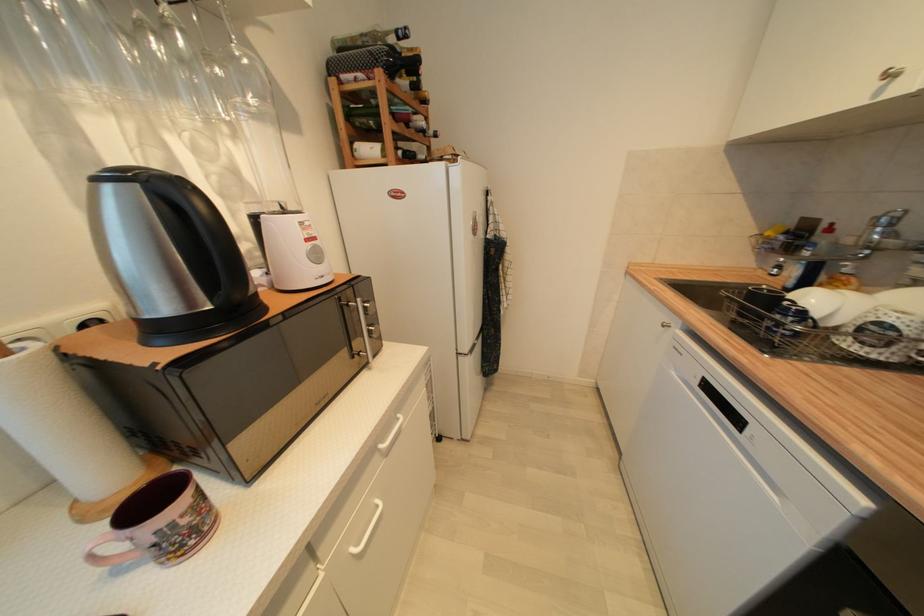
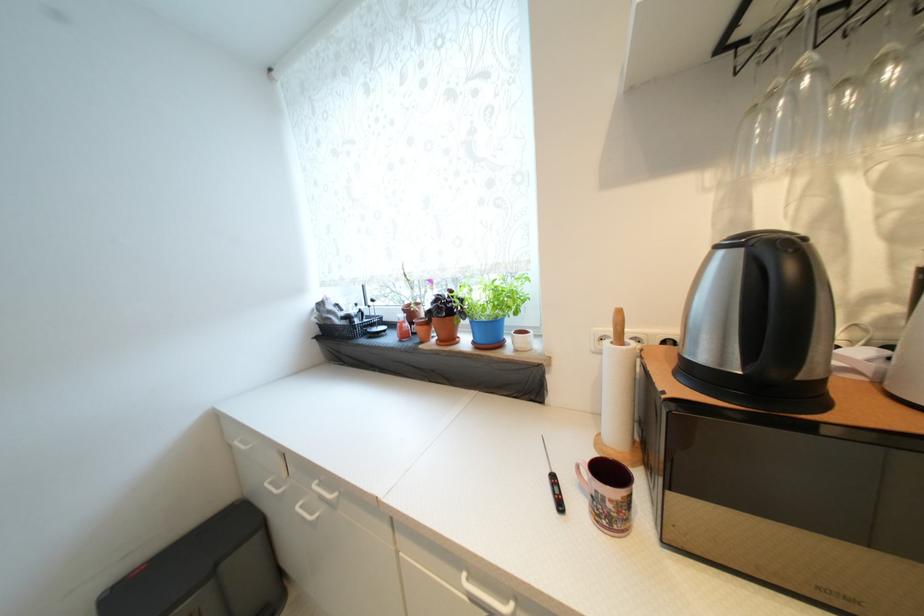
In the second image, find the point that corresponds to pixel 190 523 in the first image.

(614, 508)